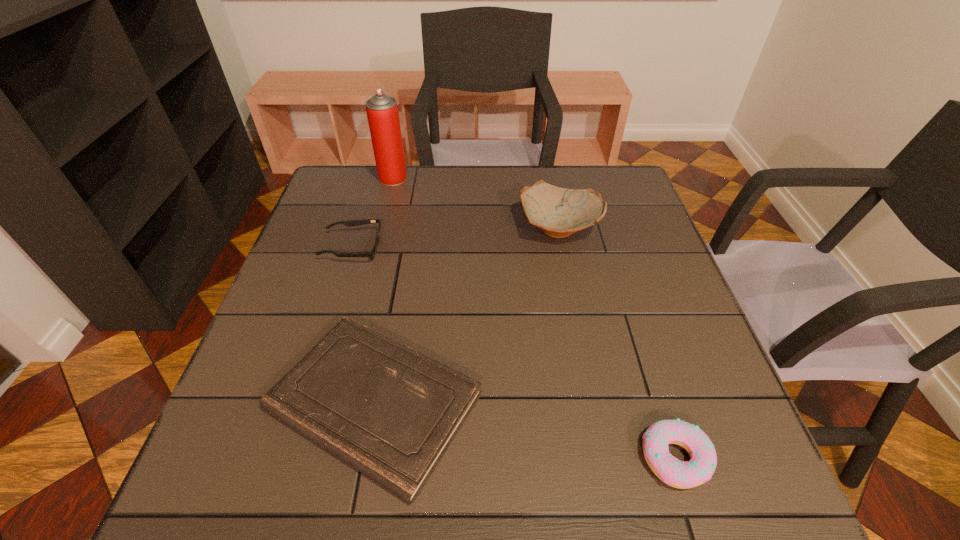
The width and height of the screenshot is (960, 540). I want to click on free space that is in between the paperback book and the sunglasses, so click(364, 325).

At what (x,y) coordinates should I click in order to perform the action: click on blank region between the sunglasses and the doughnut. Please return your answer as a coordinate pair (x, y). Looking at the image, I should click on (515, 353).

I want to click on empty location between the tallest object and the sunglasses, so click(372, 213).

Locate an element on the screen. This screenshot has height=540, width=960. unoccupied area between the doughnut and the shortest object is located at coordinates (525, 430).

Where is `empty location between the farthest object and the fourth shortest object`? This screenshot has width=960, height=540. empty location between the farthest object and the fourth shortest object is located at coordinates (476, 202).

Locate an element on the screen. This screenshot has height=540, width=960. vacant point located between the second tallest object and the sunglasses is located at coordinates (456, 238).

Identify the location of blank region between the pottery and the paperback book. This screenshot has height=540, width=960. (467, 314).

Find the location of `vacant space that is in between the doughnut and the sunglasses`. vacant space that is in between the doughnut and the sunglasses is located at coordinates (515, 353).

Find the location of a particular element. free space between the paperback book and the pottery is located at coordinates click(x=467, y=314).

Identify which object is located as the second nearest to the pottery. Please provide its 2D coordinates. Your answer should be formatted as a tuple, i.e. [(x, y)], where the tuple contains the x and y coordinates of a point satisfying the conditions above.

[(382, 112)]